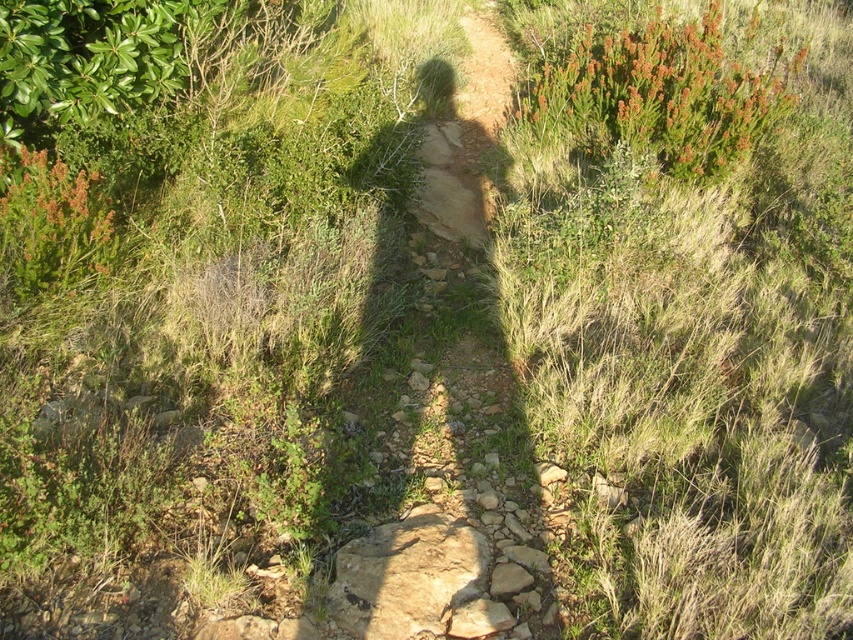
You are a hiker carrying a heavy backpack and need to reach the green leafy bush at upper right from the dirt path at center. Considering the distance between them, can you estimate whether you can walk directly to the bush without needing to detour around the dense vegetation?

The distance between the dirt path at center and the green leafy bush at upper right is 4.43 meters. Since the vegetation is dense around them, you can walk directly to the bush without needing to detour as the distance is manageable for a hiker with a backpack.

You are a hiker carrying a large backpack and need to walk along the dirt path at center. There is also a green leafy bush at upper right nearby. Which of these two has a greater width?

The green leafy bush at upper right has a greater width than the dirt path at center.

You are a hiker trying to find the main trail in this overgrown area. You see a point marked at coordinates (x=447, y=422). What is located at that point?

The dirt path at center is located at point (x=447, y=422).